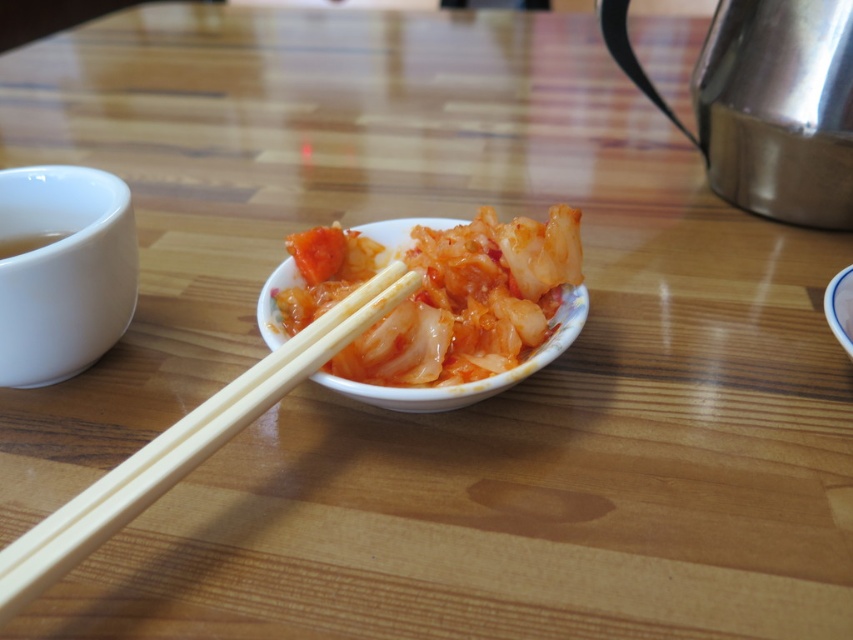
You are setting the table for a meal and see the white ceramic bowl at left and the white glossy bowl at center. Which bowl is placed on top of the other?

The white ceramic bowl at left is positioned over the white glossy bowl at center, meaning it is placed on top of it.

You are a robot trying to pick up an object from the table. You need to move your robotic arm to the point closer to you. Which point should you move to, point (276, 394) or point (834, 285)?

Point (276, 394) is in front of point (834, 285), so you should move your robotic arm to point (276, 394) since it is closer to you.

You are standing at the origin point in the center of the image. A white ceramic bowl at left is located at coordinates point (x=62, y=269). If you want to move towards the white ceramic bowl at left, which direction should you move in terms of x and y coordinates?

The point (x=62, y=269) is the location of the white ceramic bowl at left. Since the origin is at the center, moving towards the bowl would require moving in the positive x and negative y direction.